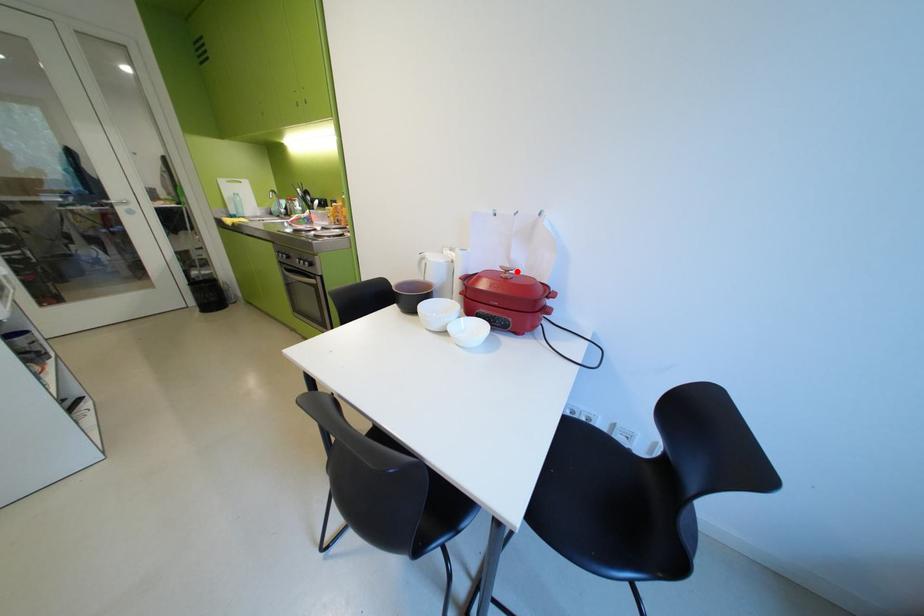
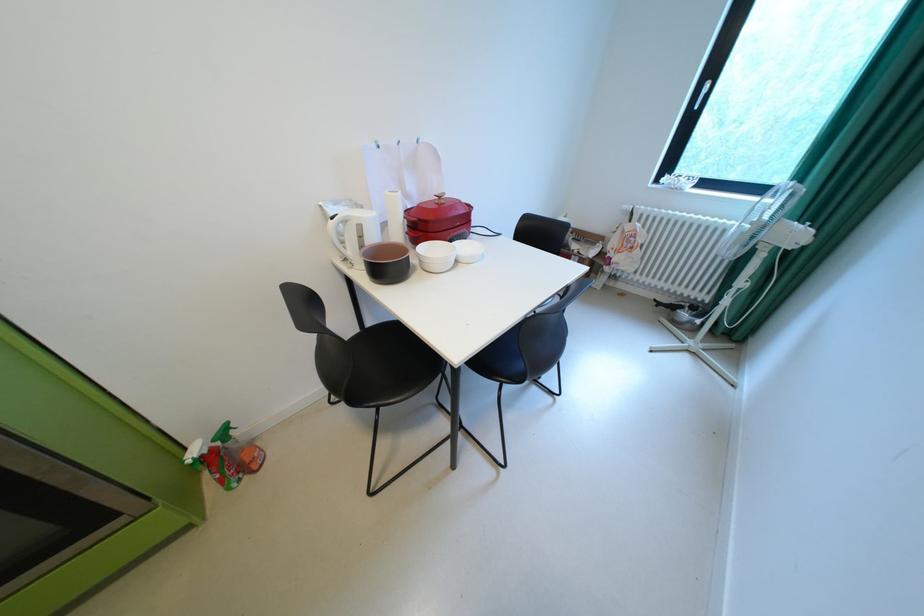
Question: I am providing you with two images of the same scene from different viewpoints. In image1, a red point is highlighted. Considering the same 3D point in image2, which of the following is correct?

Choices:
 (A) It is closer
 (B) It is farther

Answer: (A)